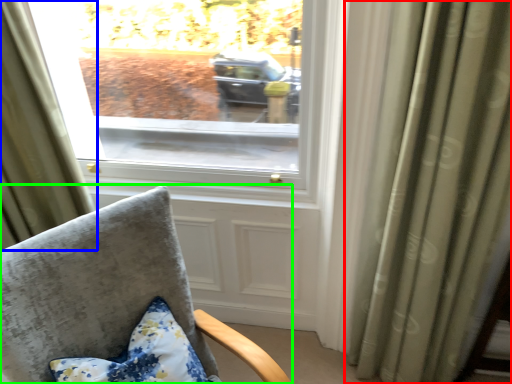
Question: Which is nearer to the curtain (highlighted by a red box)? curtain (highlighted by a blue box) or chair (highlighted by a green box).

Choices:
 (A) curtain
 (B) chair

Answer: (B)